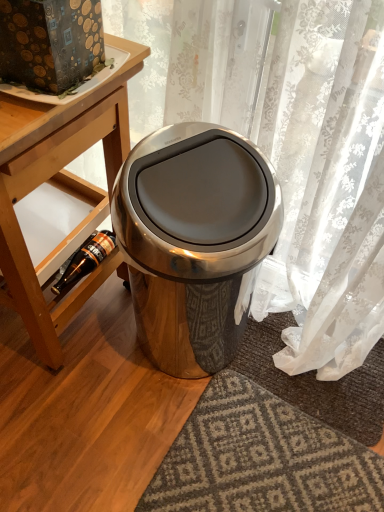
What is the approximate width of wooden shelf at lower left?

16.66 inches.

What do you see at coordinates (193, 239) in the screenshot?
I see `satin metallic trash can at center` at bounding box center [193, 239].

In order to click on brown glass bottle at lower left in this screenshot , I will do coord(85,260).

At what (x,y) coordinates should I click in order to perform the action: click on wooden shelf at lower left. Please return your answer as a coordinate pair (x, y). The image size is (384, 512). Looking at the image, I should click on pyautogui.click(x=63, y=218).

Is point (19, 219) positioned in front of point (42, 349)?

No, it is behind (42, 349).

Find the location of a particular element. This screenshot has width=384, height=512. table above the wooden shelf at lower left (from a real-world perspective) is located at coordinates (60, 186).

Looking at this image, can we say wooden shelf at lower left lies outside wooden table at lower left?

No, wooden shelf at lower left is not entirely external to wooden table at lower left.

In the image, is wooden shelf at lower left positioned in front of or behind wooden table at lower left?

wooden shelf at lower left is positioned farther from the viewer than wooden table at lower left.

Would you say wooden table at lower left is to the left or to the right of wooden shelf at lower left in the picture?

Clearly, wooden table at lower left is on the left of wooden shelf at lower left in the image.

Who is shorter, wooden table at lower left or wooden shelf at lower left?

With less height is wooden shelf at lower left.

From a real-world perspective, is wooden table at lower left positioned under wooden shelf at lower left based on gravity?

No, from a real-world perspective, wooden table at lower left is not beneath wooden shelf at lower left.

Is wooden table at lower left closer to camera compared to wooden shelf at lower left?

Yes, wooden table at lower left is closer to the camera.

Is satin metallic trash can at center in front of wooden shelf at lower left?

Yes, satin metallic trash can at center is closer to the camera.

Is satin metallic trash can at center wider than wooden shelf at lower left?

Incorrect, the width of satin metallic trash can at center does not surpass that of wooden shelf at lower left.

Which is in front, point (84, 251) or point (183, 294)?

The point (183, 294) is closer to the camera.

Is brown glass bottle at lower left touching satin metallic trash can at center?

brown glass bottle at lower left and satin metallic trash can at center are not in contact.

Based on their positions, is brown glass bottle at lower left located to the left or right of satin metallic trash can at center?

Clearly, brown glass bottle at lower left is on the left of satin metallic trash can at center in the image.

Can you confirm if brown glass bottle at lower left is wider than satin metallic trash can at center?

No.

Considering the sizes of satin metallic trash can at center and brown glass bottle at lower left in the image, is satin metallic trash can at center bigger or smaller than brown glass bottle at lower left?

In the image, satin metallic trash can at center appears to be larger than brown glass bottle at lower left.

From a real-world perspective, relative to brown glass bottle at lower left, is satin metallic trash can at center vertically above or below?

satin metallic trash can at center is situated higher than brown glass bottle at lower left in the real world.

Is satin metallic trash can at center not near brown glass bottle at lower left?

No, satin metallic trash can at center is not far away from brown glass bottle at lower left.

Does brown glass bottle at lower left lie in front of wooden table at lower left?

No, brown glass bottle at lower left is behind wooden table at lower left.

In order to click on bottle located on the right of wooden table at lower left in this screenshot , I will do `click(85, 260)`.

Who is smaller, brown glass bottle at lower left or wooden table at lower left?

Smaller between the two is brown glass bottle at lower left.

Is wooden shelf at lower left closer to camera compared to satin metallic trash can at center?

No, wooden shelf at lower left is behind satin metallic trash can at center.

In the scene shown: How different are the orientations of wooden shelf at lower left and satin metallic trash can at center in degrees?

10.6 degrees.

Is wooden shelf at lower left next to satin metallic trash can at center?

No, wooden shelf at lower left is not making contact with satin metallic trash can at center.

Does wooden shelf at lower left have a greater height compared to satin metallic trash can at center?

In fact, wooden shelf at lower left may be shorter than satin metallic trash can at center.

I want to click on table in front of the wooden shelf at lower left, so click(60, 186).

This screenshot has width=384, height=512. I want to click on table above the wooden shelf at lower left (from the image's perspective), so click(60, 186).

Estimate the real-world distances between objects in this image. Which object is further from brown glass bottle at lower left, wooden table at lower left or wooden shelf at lower left?

wooden table at lower left is positioned further to the anchor brown glass bottle at lower left.

Based on their spatial positions, is wooden table at lower left or wooden shelf at lower left further from satin metallic trash can at center?

wooden shelf at lower left is further to satin metallic trash can at center.

Estimate the real-world distances between objects in this image. Which object is closer to satin metallic trash can at center, brown glass bottle at lower left or wooden table at lower left?

wooden table at lower left.

Estimate the real-world distances between objects in this image. Which object is closer to wooden shelf at lower left, brown glass bottle at lower left or wooden table at lower left?

brown glass bottle at lower left is positioned closer to the anchor wooden shelf at lower left.

Estimate the real-world distances between objects in this image. Which object is closer to wooden table at lower left, satin metallic trash can at center or wooden shelf at lower left?

wooden shelf at lower left.

When comparing their distances from satin metallic trash can at center, does brown glass bottle at lower left or wooden shelf at lower left seem closer?

wooden shelf at lower left is closer to satin metallic trash can at center.

Estimate the real-world distances between objects in this image. Which object is further from wooden shelf at lower left, wooden table at lower left or satin metallic trash can at center?

satin metallic trash can at center lies further to wooden shelf at lower left than the other object.

When comparing their distances from brown glass bottle at lower left, does wooden shelf at lower left or satin metallic trash can at center seem further?

Among the two, satin metallic trash can at center is located further to brown glass bottle at lower left.

At what (x,y) coordinates should I click in order to perform the action: click on bottle between wooden shelf at lower left and satin metallic trash can at center from left to right. Please return your answer as a coordinate pair (x, y). Looking at the image, I should click on (85, 260).

Where is `shelf located between wooden table at lower left and brown glass bottle at lower left in the depth direction`? shelf located between wooden table at lower left and brown glass bottle at lower left in the depth direction is located at coordinates (63, 218).

The image size is (384, 512). I want to click on shelf between wooden table at lower left and satin metallic trash can at center, so click(x=63, y=218).

Image resolution: width=384 pixels, height=512 pixels. Find the location of `bottle between wooden table at lower left and satin metallic trash can at center from left to right`. bottle between wooden table at lower left and satin metallic trash can at center from left to right is located at coordinates (85, 260).